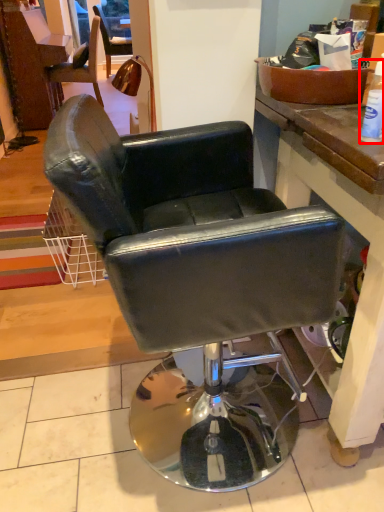
Question: From the image's perspective, where is bottle (annotated by the red box) located relative to chair?

Choices:
 (A) below
 (B) above

Answer: (B)